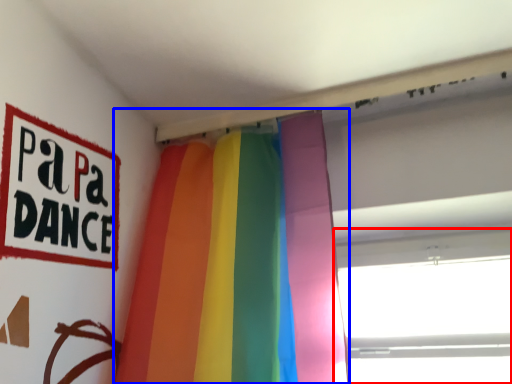
Question: Which object appears closest to the camera in this image, window (highlighted by a red box) or curtain (highlighted by a blue box)?

Choices:
 (A) window
 (B) curtain

Answer: (B)